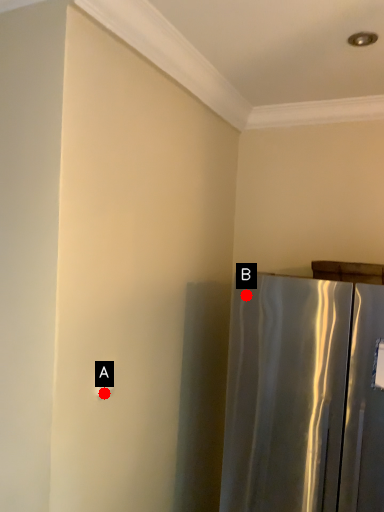
Question: Two points are circled on the image, labeled by A and B beside each circle. Which point appears farthest from the camera in this image?

Choices:
 (A) A is further
 (B) B is further

Answer: (B)